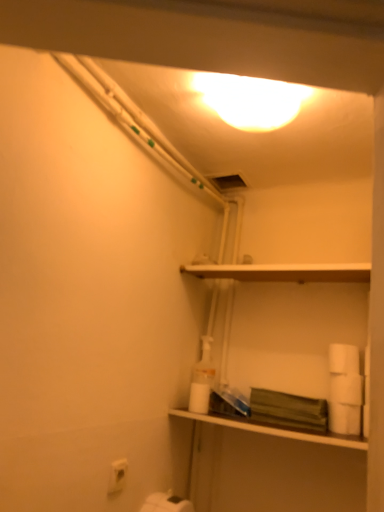
Question: In the image, is white matte shelf at upper center, the second shelf in the bottom-to-top sequence, positioned in front of or behind white matte toilet paper at lower right, the 3th toilet paper viewed from the right?

Choices:
 (A) behind
 (B) front

Answer: (B)

Question: In terms of width, does white matte shelf at upper center, marked as the first shelf in a top-to-bottom arrangement, look wider or thinner when compared to white matte toilet paper at lower right, the 3th toilet paper viewed from the right?

Choices:
 (A) thin
 (B) wide

Answer: (B)

Question: Which object is positioned farthest from the white matte toilet paper at lower right, placed as the third toilet paper when sorted from left to right?

Choices:
 (A) white matte toilet paper at lower center, marked as the fourth toilet paper in a right-to-left arrangement
 (B) white matte toilet paper at right, the fourth toilet paper positioned from the left
 (C) translucent plastic bottle at center
 (D) matte white shelf at center, placed as the first shelf when sorted from bottom to top
 (E) white matte toilet paper at lower right, the first toilet paper in the left-to-right sequence

Answer: (E)

Question: Considering the real-world distances, which object is farthest from the white matte toilet paper at right, the fourth toilet paper positioned from the left?

Choices:
 (A) translucent plastic bottle at center
 (B) white matte toilet paper at lower right, the 5th toilet paper positioned from the right
 (C) matte yellow light at upper center
 (D) white matte toilet paper at lower center, which is the 2th toilet paper from left to right
 (E) white matte toilet paper at lower right, acting as the 1th toilet paper starting from the right

Answer: (C)